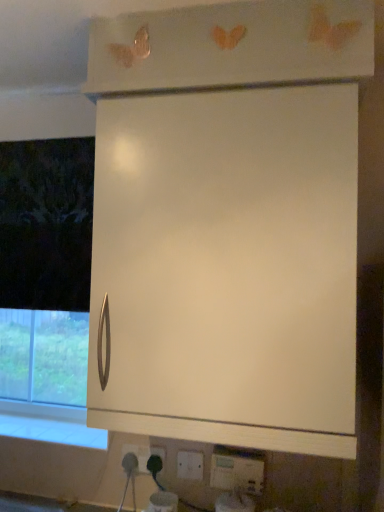
Question: From the image's perspective, is white matte cabinet at center located above or below white glossy window sill at lower left?

Choices:
 (A) above
 (B) below

Answer: (A)

Question: Considering the relative positions of white matte cabinet at center and white glossy window sill at lower left in the image provided, is white matte cabinet at center to the left or to the right of white glossy window sill at lower left?

Choices:
 (A) right
 (B) left

Answer: (A)

Question: Which object is the closest to the white plastic socket at lower center, marked as the third electric outlet in a front-to-back arrangement?

Choices:
 (A) white matte cabinet at center
 (B) white plastic electric outlet at lower center, the 3th electric outlet positioned from the left
 (C) white glossy window sill at lower left
 (D) white plastic electric outlet at lower center, the second electric outlet when ordered from front to back

Answer: (D)

Question: Considering the real-world distances, which object is farthest from the white matte cabinet at center?

Choices:
 (A) white glossy window sill at lower left
 (B) white plastic socket at lower center, the third electric outlet positioned from the right
 (C) white plastic electric outlet at lower center, marked as the second electric outlet in a left-to-right arrangement
 (D) white plastic electric outlet at lower center, placed as the 1th electric outlet when sorted from front to back

Answer: (B)